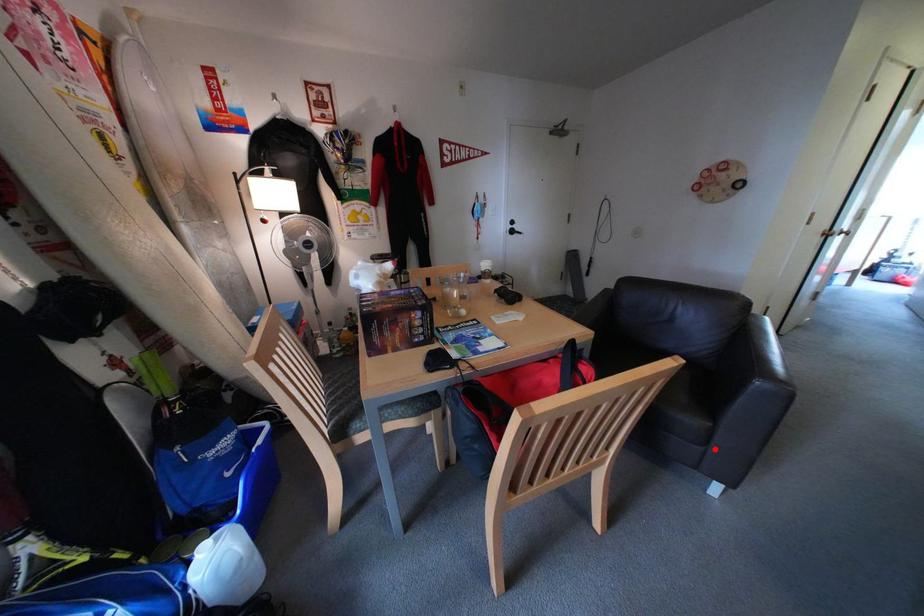
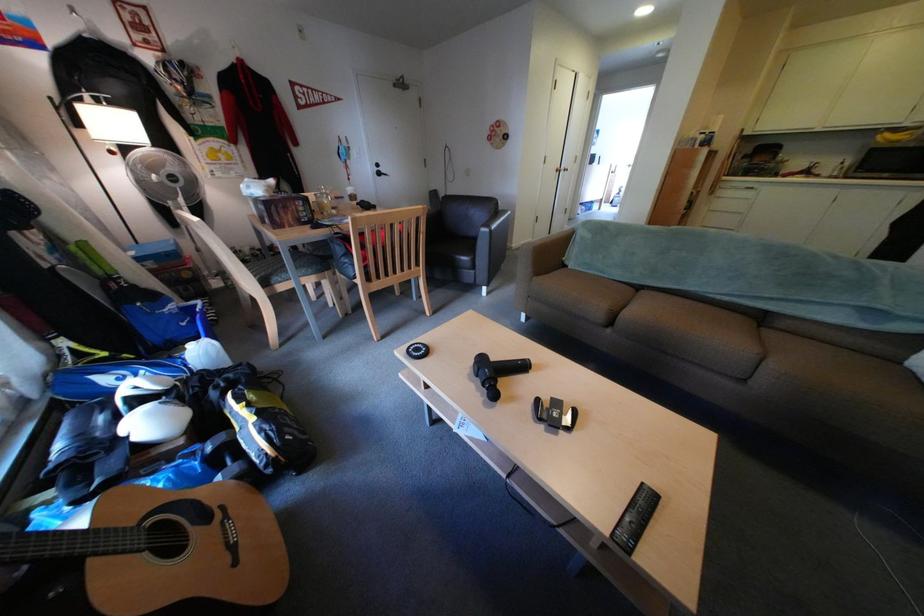
Question: A red point is marked in image1. In image2, is the corresponding 3D point closer to the camera or farther? Reply with the corresponding letter.

Choices:
 (A) The corresponding 3D point is closer.
 (B) The corresponding 3D point is farther.

Answer: (A)